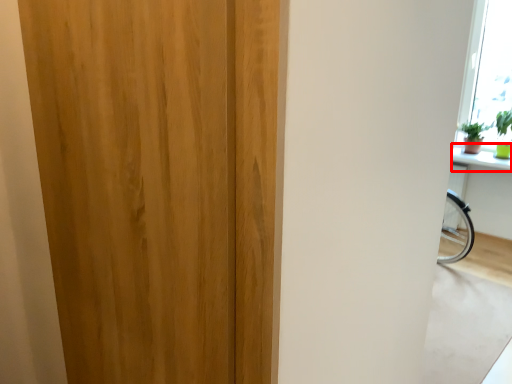
Question: Where is window sill (annotated by the red box) located in relation to door in the image?

Choices:
 (A) right
 (B) left

Answer: (A)